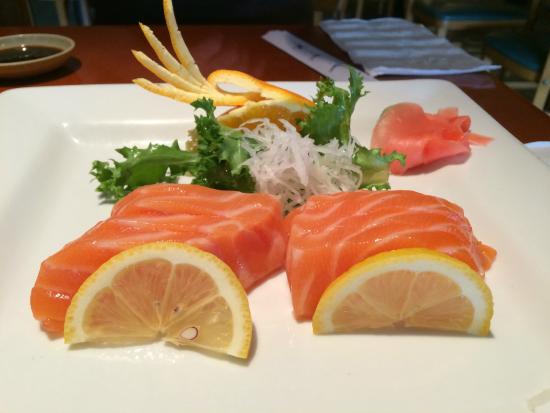
I want to click on chairs, so click(522, 56), click(454, 17).